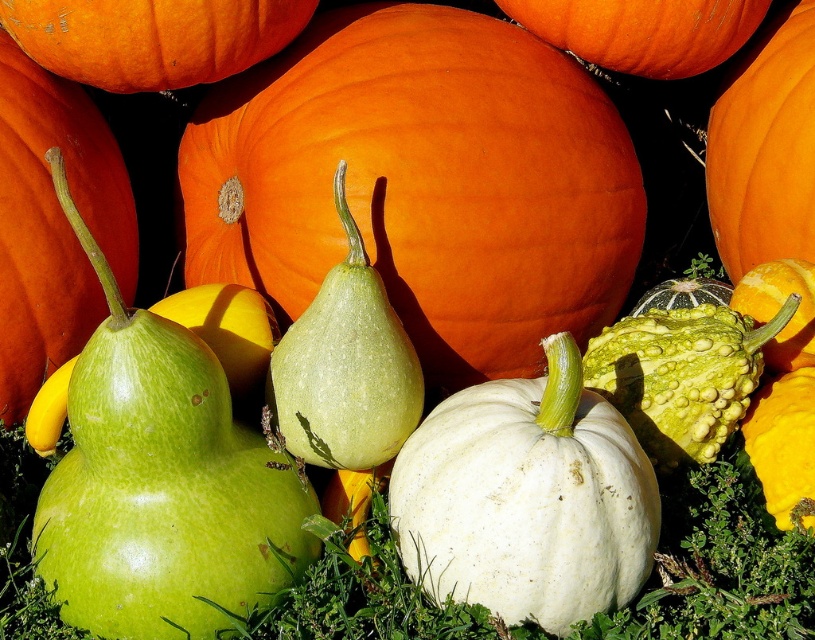
Is point (434, 369) positioned after point (534, 499)?

Yes, it is.

Can you confirm if orange matte pumpkin at center is positioned below white matte pumpkin at center?

Incorrect, orange matte pumpkin at center is not positioned below white matte pumpkin at center.

Where is `orange matte pumpkin at center`? orange matte pumpkin at center is located at coordinates (421, 182).